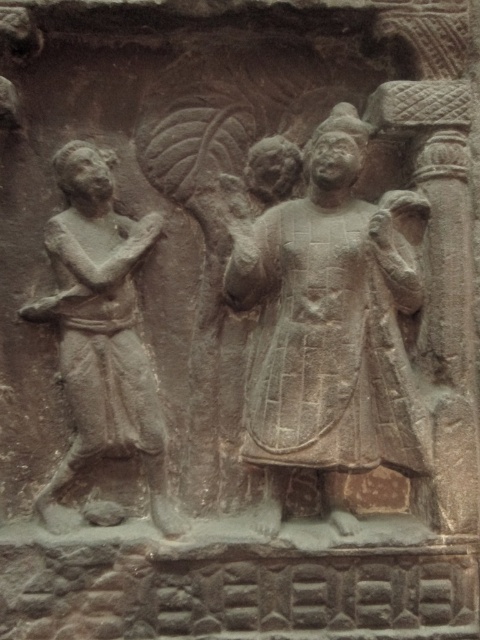
Based on the scene description, which figure is taller, the carved stone figure at center or the gray stone figure at left?

The carved stone figure at center is taller than the gray stone figure at left according to the description.

Based on the scene described, which figure, the carved stone figure at center or the gray stone figure at left, is positioned to show authority through size?

The carved stone figure at center is larger in size than the gray stone figure at left, indicating a position of authority.

You are an art conservator standing 1.5 meters away from the stone relief sculpture. You need to examine the carved stone figure at center closely. Can you reach it without moving closer?

The carved stone figure at center is 1.28 meters away from the viewer. Since you are standing 1.5 meters away, you are slightly farther than the specified distance. To examine it closely, you would need to move 0.22 meters closer to be within the 1.28 meter distance.